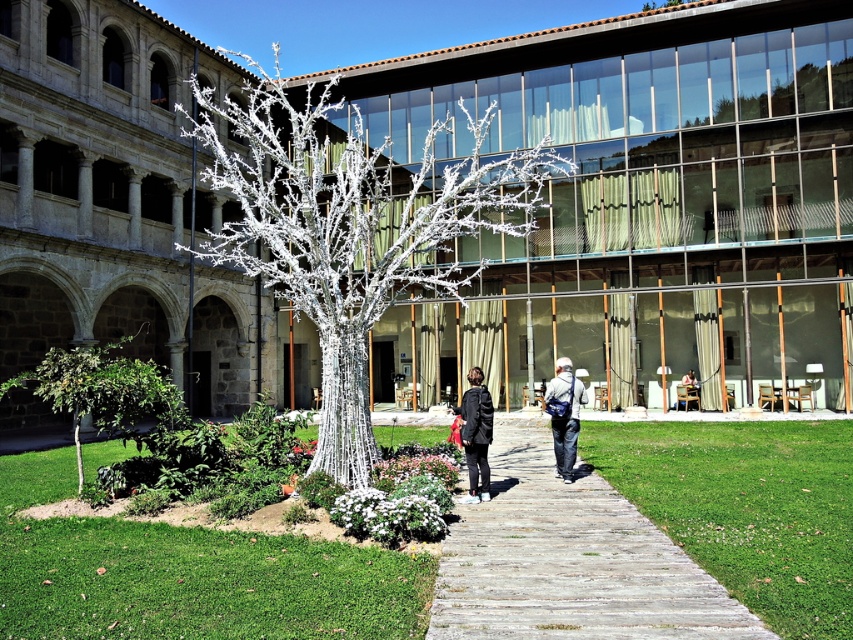
Question: Is wooden walkway at center thinner than matte black backpack at center?

Choices:
 (A) no
 (B) yes

Answer: (A)

Question: Is silver metallic tree at center above wooden walkway at center?

Choices:
 (A) no
 (B) yes

Answer: (B)

Question: Which point is farther from the camera taking this photo?

Choices:
 (A) (561, 476)
 (B) (486, 586)

Answer: (A)

Question: Is silver metallic tree at center to the left of wooden walkway at center from the viewer's perspective?

Choices:
 (A) yes
 (B) no

Answer: (A)

Question: Based on their relative distances, which object is farther from the dark gray fabric jacket at center?

Choices:
 (A) silver metallic tree at center
 (B) matte black backpack at center
 (C) wooden walkway at center

Answer: (A)

Question: Among these objects, which one is farthest from the camera?

Choices:
 (A) silver metallic tree at center
 (B) dark gray fabric jacket at center
 (C) wooden walkway at center
 (D) matte black backpack at center

Answer: (D)